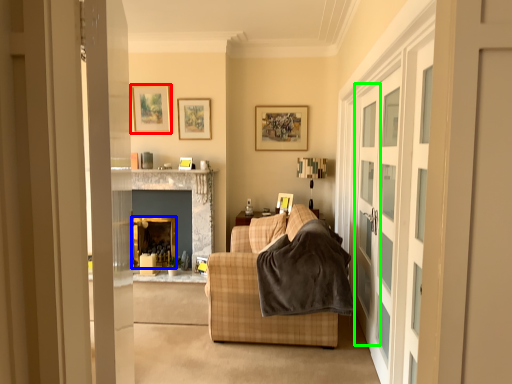
Question: Which object is the farthest from picture frame (highlighted by a red box)? Choose among these: fireplace (highlighted by a blue box) or screen door (highlighted by a green box).

Choices:
 (A) fireplace
 (B) screen door

Answer: (B)